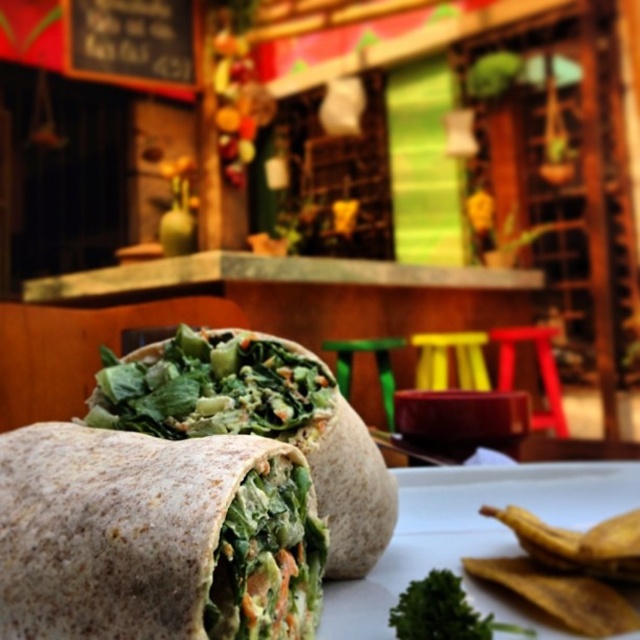
Question: Does whole wheat wrap at center have a lesser width compared to green leafy burrito at center?

Choices:
 (A) no
 (B) yes

Answer: (B)

Question: Can you confirm if whole wheat wrap at center is positioned below green leafy burrito at center?

Choices:
 (A) yes
 (B) no

Answer: (A)

Question: Which point is closer to the camera?

Choices:
 (A) (205, 406)
 (B) (298, 636)

Answer: (B)

Question: Can you confirm if whole wheat wrap at center is positioned to the left of green leafy burrito at center?

Choices:
 (A) yes
 (B) no

Answer: (A)

Question: Among these objects, which one is nearest to the camera?

Choices:
 (A) whole wheat wrap at center
 (B) green leafy burrito at center

Answer: (A)